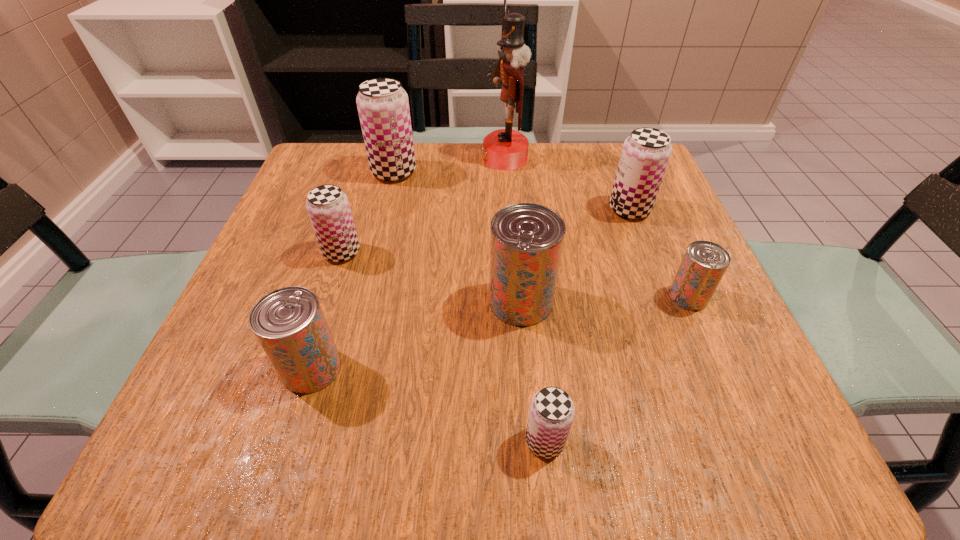
I want to click on the fifth nearest object, so click(328, 207).

Where is `the rightmost red beer can`? the rightmost red beer can is located at coordinates (704, 264).

Where is `the nearest purple beer can`? This screenshot has width=960, height=540. the nearest purple beer can is located at coordinates (551, 413).

The image size is (960, 540). I want to click on the nearest beer can, so click(x=551, y=413).

Image resolution: width=960 pixels, height=540 pixels. I want to click on vacant space located 0.290m on the front-facing side of the tallest object, so click(362, 158).

The height and width of the screenshot is (540, 960). I want to click on vacant space located 0.260m on the front-facing side of the tallest object, so click(374, 158).

Where is `free space located on the front-facing side of the tallest object`? This screenshot has height=540, width=960. free space located on the front-facing side of the tallest object is located at coordinates (441, 158).

At what (x,y) coordinates should I click in order to perform the action: click on free space located on the right of the farthest purple beer can. Please return your answer as a coordinate pair (x, y). Looking at the image, I should click on (560, 172).

Locate an element on the screen. The width and height of the screenshot is (960, 540). vacant space located on the front of the second farthest beer can is located at coordinates (652, 268).

Find the location of a particular element. The height and width of the screenshot is (540, 960). vacant area located 0.380m on the left of the second red beer can from left to right is located at coordinates (263, 301).